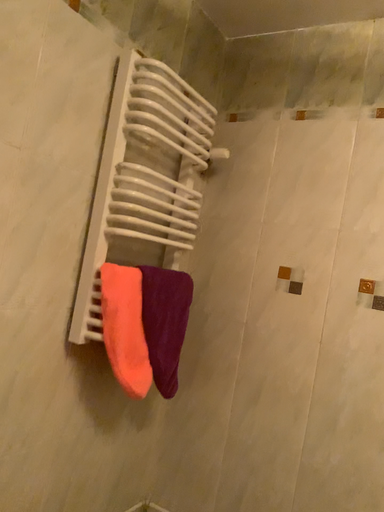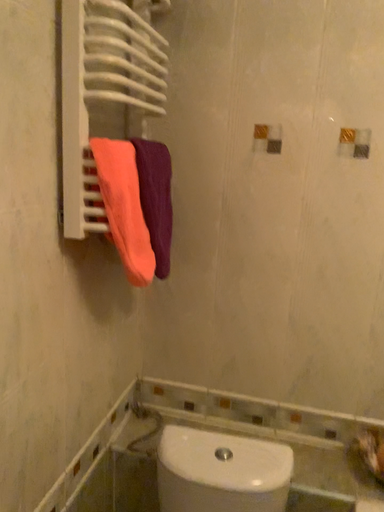
Question: Which way did the camera rotate in the video?

Choices:
 (A) rotated upward
 (B) rotated downward

Answer: (B)